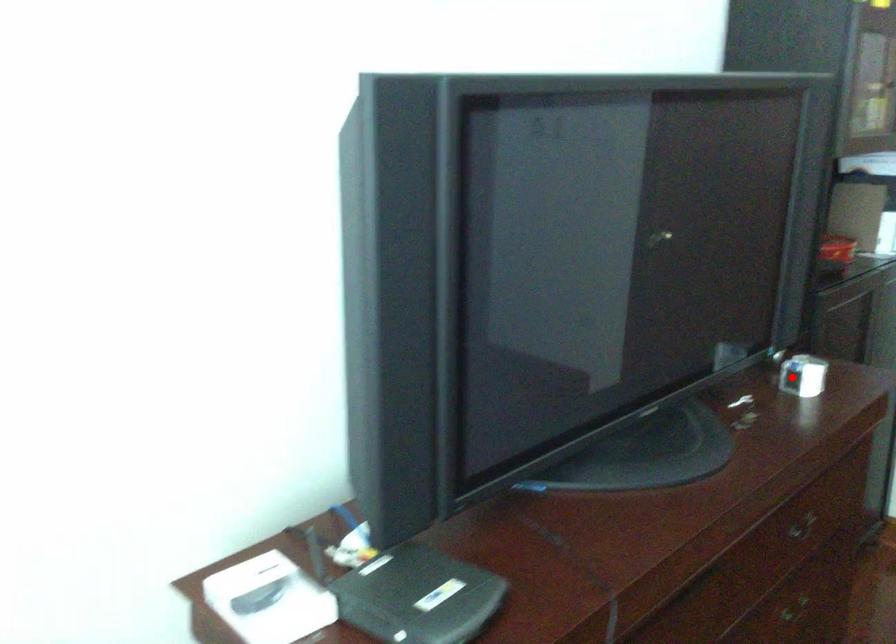
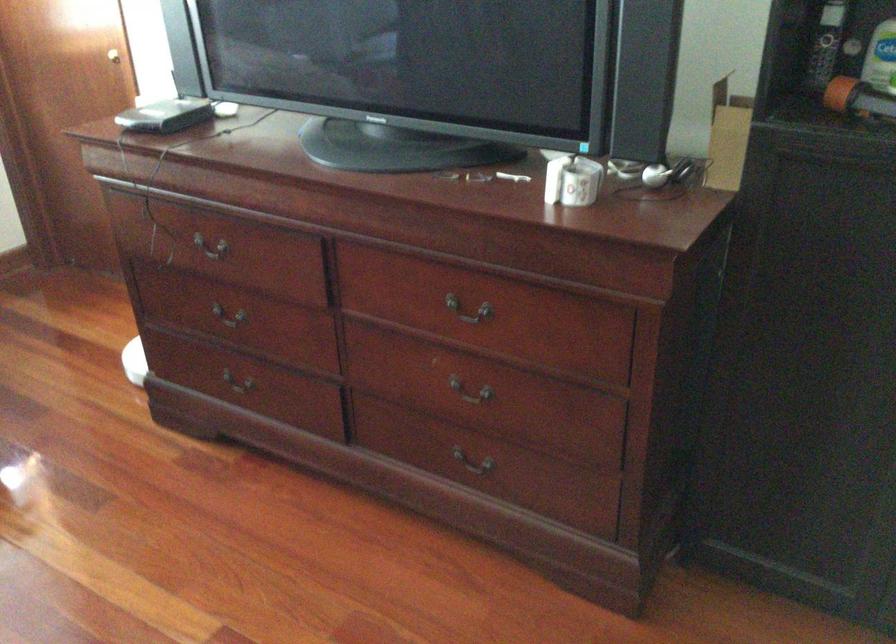
Question: I am providing you with two images of the same scene from different viewpoints. A red point is marked on the first image. Is the red point's position out of view in image 2?

Choices:
 (A) Yes
 (B) No

Answer: (B)